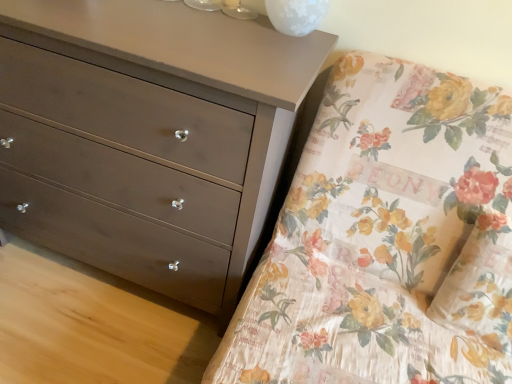
Question: Does floral fabric bed at upper right appear on the left side of matte brown dresser at left?

Choices:
 (A) yes
 (B) no

Answer: (B)

Question: Is floral fabric bed at upper right completely or partially outside of matte brown dresser at left?

Choices:
 (A) yes
 (B) no

Answer: (A)

Question: Considering the relative sizes of floral fabric bed at upper right and matte brown dresser at left in the image provided, is floral fabric bed at upper right taller than matte brown dresser at left?

Choices:
 (A) no
 (B) yes

Answer: (A)

Question: Does floral fabric bed at upper right turn towards matte brown dresser at left?

Choices:
 (A) no
 (B) yes

Answer: (A)

Question: Considering the relative sizes of floral fabric bed at upper right and matte brown dresser at left in the image provided, is floral fabric bed at upper right shorter than matte brown dresser at left?

Choices:
 (A) no
 (B) yes

Answer: (B)

Question: From the image's perspective, is white frosted glass at upper center above or below floral fabric pillow at right?

Choices:
 (A) below
 (B) above

Answer: (B)

Question: From a real-world perspective, is white frosted glass at upper center positioned above or below floral fabric pillow at right?

Choices:
 (A) below
 (B) above

Answer: (B)

Question: Would you say white frosted glass at upper center is inside or outside floral fabric pillow at right?

Choices:
 (A) outside
 (B) inside

Answer: (A)

Question: Does point (309, 8) appear closer or farther from the camera than point (507, 223)?

Choices:
 (A) farther
 (B) closer

Answer: (A)

Question: Is floral fabric bed at upper right in front of or behind white frosted glass at upper center in the image?

Choices:
 (A) behind
 (B) front

Answer: (B)

Question: Based on their sizes in the image, would you say floral fabric bed at upper right is bigger or smaller than white frosted glass at upper center?

Choices:
 (A) big
 (B) small

Answer: (A)

Question: Is floral fabric bed at upper right to the left or to the right of white frosted glass at upper center in the image?

Choices:
 (A) right
 (B) left

Answer: (A)

Question: From the image's perspective, is floral fabric bed at upper right above or below white frosted glass at upper center?

Choices:
 (A) above
 (B) below

Answer: (B)

Question: Relative to floral fabric bed at upper right, is matte brown dresser at left in front or behind?

Choices:
 (A) behind
 (B) front

Answer: (A)

Question: Looking at the image, does matte brown dresser at left seem bigger or smaller compared to floral fabric bed at upper right?

Choices:
 (A) small
 (B) big

Answer: (A)